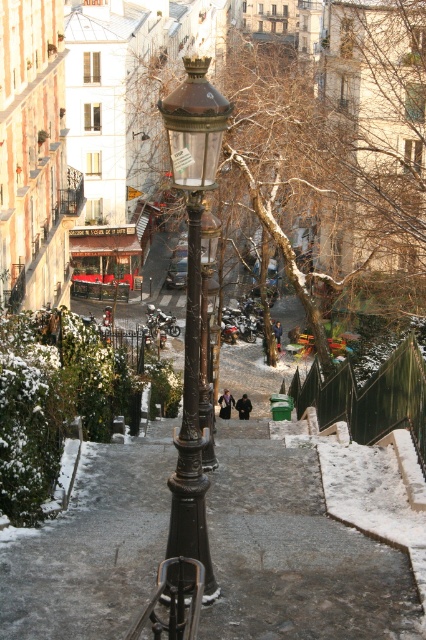
Is bronze/golden lamppost at center to the right of bronze/marble street light at center from the viewer's perspective?

In fact, bronze/golden lamppost at center is to the left of bronze/marble street light at center.

I want to click on bronze/golden lamppost at center, so click(192, 300).

The height and width of the screenshot is (640, 426). In order to click on bronze/golden lamppost at center in this screenshot , I will do `click(192, 300)`.

Measure the distance from bare branches at center to bronze/golden lamppost at center.

26.90 meters

Does bare branches at center lie in front of bronze/golden lamppost at center?

No.

Does point (322, 170) come behind point (199, 504)?

Yes.

Identify the location of bare branches at center. This screenshot has width=426, height=640. (337, 141).

Looking at this image, can you confirm if bare branches at center is bigger than bronze/marble street light at center?

Yes, bare branches at center is bigger than bronze/marble street light at center.

Does point (265, 211) come closer to viewer compared to point (212, 241)?

No, it is not.

Measure the distance between bare branches at center and camera.

The distance of bare branches at center from camera is 7.33 meters.

Where is `bare branches at center`? bare branches at center is located at coordinates (337, 141).